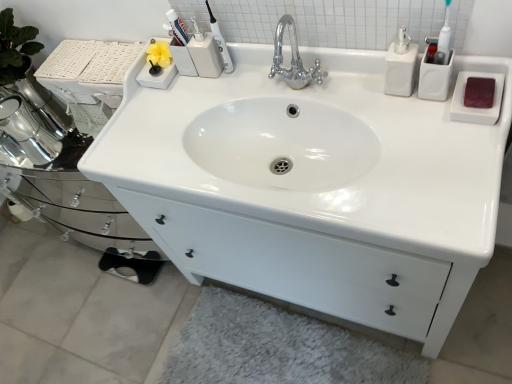
Question: Is matte plastic toothbrush at upper center behind white glossy sink at center?

Choices:
 (A) no
 (B) yes

Answer: (B)

Question: Considering the relative sizes of matte plastic toothbrush at upper center and white glossy sink at center in the image provided, is matte plastic toothbrush at upper center shorter than white glossy sink at center?

Choices:
 (A) no
 (B) yes

Answer: (B)

Question: Is matte plastic toothbrush at upper center surrounding white glossy sink at center?

Choices:
 (A) no
 (B) yes

Answer: (A)

Question: Considering the relative sizes of matte plastic toothbrush at upper center and white glossy sink at center in the image provided, is matte plastic toothbrush at upper center taller than white glossy sink at center?

Choices:
 (A) no
 (B) yes

Answer: (A)

Question: Is white glossy sink at center at the back of matte plastic toothbrush at upper center?

Choices:
 (A) no
 (B) yes

Answer: (A)

Question: Is the depth of matte plastic toothbrush at upper center less than that of white glossy sink at center?

Choices:
 (A) no
 (B) yes

Answer: (A)

Question: From a real-world perspective, does white fluffy bath mat at lower center stand above white glossy soap dispenser at upper right?

Choices:
 (A) no
 (B) yes

Answer: (A)

Question: Is white fluffy bath mat at lower center oriented away from white glossy soap dispenser at upper right?

Choices:
 (A) yes
 (B) no

Answer: (B)

Question: Is white fluffy bath mat at lower center next to white glossy soap dispenser at upper right and touching it?

Choices:
 (A) no
 (B) yes

Answer: (A)

Question: Does white fluffy bath mat at lower center turn towards white glossy soap dispenser at upper right?

Choices:
 (A) yes
 (B) no

Answer: (B)

Question: Considering the relative sizes of white fluffy bath mat at lower center and white glossy soap dispenser at upper right in the image provided, is white fluffy bath mat at lower center smaller than white glossy soap dispenser at upper right?

Choices:
 (A) no
 (B) yes

Answer: (A)

Question: From the image's perspective, would you say white fluffy bath mat at lower center is positioned over white glossy soap dispenser at upper right?

Choices:
 (A) yes
 (B) no

Answer: (B)

Question: Can you see white glossy soap dispenser at upper right touching white glossy sink at center?

Choices:
 (A) yes
 (B) no

Answer: (B)